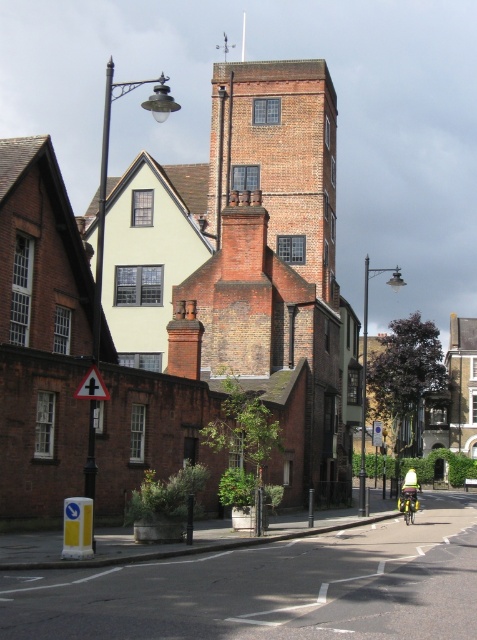
Question: Based on their relative distances, which object is farther from the green matte bicycle at center?

Choices:
 (A) metallic triangular sign at center
 (B) green fabric helmet at center

Answer: (A)

Question: Does metallic triangular sign at center have a smaller size compared to green matte bicycle at center?

Choices:
 (A) no
 (B) yes

Answer: (B)

Question: Among these objects, which one is nearest to the camera?

Choices:
 (A) metallic triangular sign at center
 (B) blue plastic sign at center
 (C) green fabric helmet at center

Answer: (A)

Question: Which of the following is the closest to the observer?

Choices:
 (A) (377, 420)
 (B) (411, 492)

Answer: (B)

Question: In this image, where is green matte bicycle at center located relative to blue plastic sign at center?

Choices:
 (A) above
 (B) below

Answer: (A)

Question: Is the position of green fabric helmet at center more distant than that of blue plastic sign at center?

Choices:
 (A) no
 (B) yes

Answer: (A)